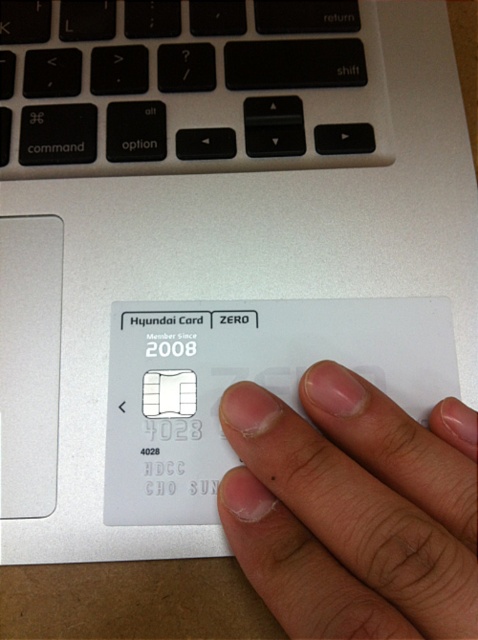
You are holding the Hyundai Card labeled ZERO and want to place a sticker on the card. You have two points marked on the card at coordinates point [123,161] and point [162,332]. Which point is closer to you when you are holding the card?

Point [123,161] is closer to you because it is further to the viewer than point [162,332].

What is the position of the nail polish matte finger at center in the image?

The nail polish matte finger at center is located at point coordinates of (x=352, y=509).

You are trying to swipe the white plastic card at center using your finger. Can your nail polish matte finger at center reach the end of the card?

The nail polish matte finger at center is shorter than the white plastic card at center, so it cannot reach the end of the card.